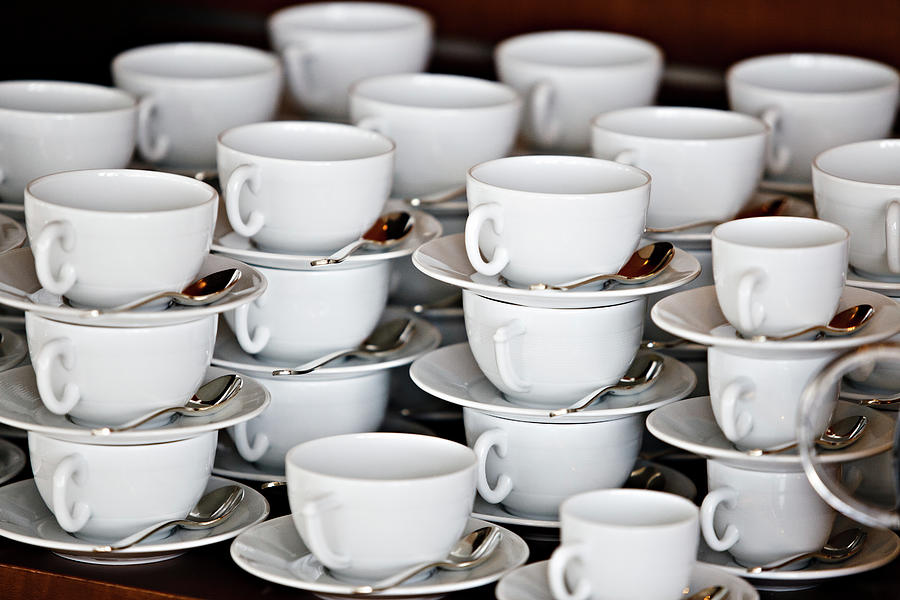
What are the coordinates of `3 white cups and saucers, stacked on top of each other, lower left corner` in the screenshot? It's located at (119, 488), (130, 368), (127, 234), (162, 331), (183, 420), (205, 536).